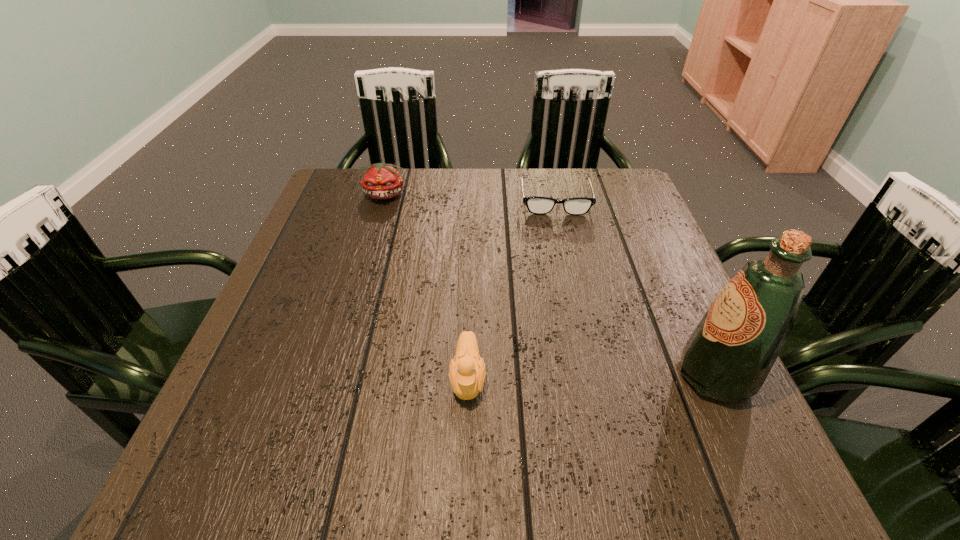
Find the location of a particular element. This screenshot has width=960, height=540. olive oil present at the right edge is located at coordinates (728, 357).

Identify the location of spectacles at the right edge. (538, 205).

Where is `object that is at the far left corner`? object that is at the far left corner is located at coordinates [381, 181].

Image resolution: width=960 pixels, height=540 pixels. What are the coordinates of `object located in the far right corner section of the desktop` in the screenshot? It's located at (538, 205).

Locate an element on the screen. object positioned at the near right corner is located at coordinates (728, 357).

This screenshot has width=960, height=540. In order to click on vacant area at the far edge in this screenshot , I will do `click(421, 192)`.

This screenshot has height=540, width=960. In the image, there is a desktop. In order to click on free space at the near edge in this screenshot , I will do `click(449, 433)`.

Find the location of a particular element. free point at the left edge is located at coordinates coord(291,282).

Locate an element on the screen. Image resolution: width=960 pixels, height=540 pixels. vacant space at the right edge of the desktop is located at coordinates (660, 254).

In the image, there is a desktop. Where is `vacant space at the far left corner`? vacant space at the far left corner is located at coordinates (370, 197).